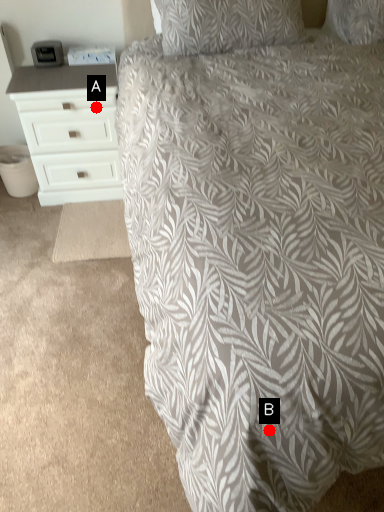
Question: Two points are circled on the image, labeled by A and B beside each circle. Among these points, which one is nearest to the camera?

Choices:
 (A) A is closer
 (B) B is closer

Answer: (B)